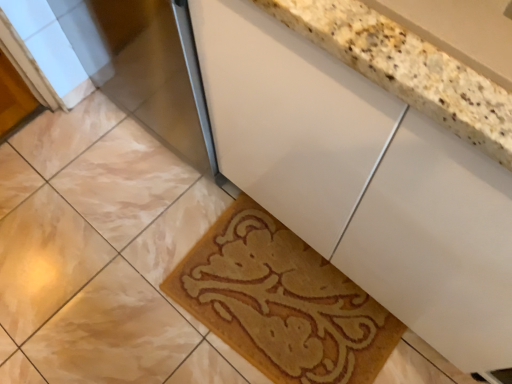
Where is `unoccupied area behind marble tile at lower left`? unoccupied area behind marble tile at lower left is located at coordinates (71, 175).